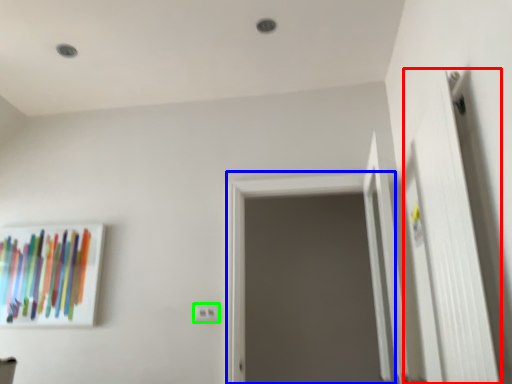
Question: Which object is positioned closest to door (highlighted by a red box)? Select from screen door (highlighted by a blue box) and electric outlet (highlighted by a green box).

Choices:
 (A) screen door
 (B) electric outlet

Answer: (A)